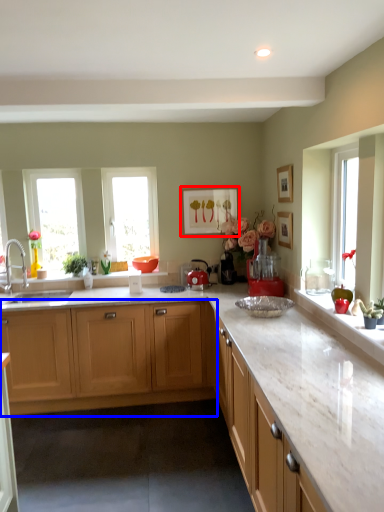
Question: Which object is further to the camera taking this photo, picture frame (highlighted by a red box) or cabinetry (highlighted by a blue box)?

Choices:
 (A) picture frame
 (B) cabinetry

Answer: (A)